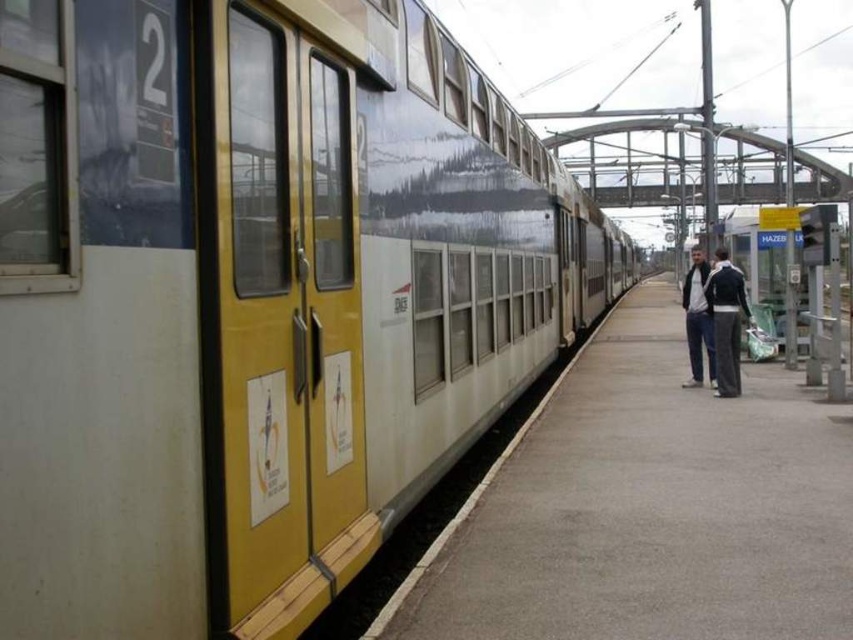
Is smooth concrete platform at center wider than dark blue jacket at center?

Yes.

Between point (753, 422) and point (735, 275), which one is positioned behind?

Positioned behind is point (735, 275).

The image size is (853, 640). What do you see at coordinates (647, 508) in the screenshot?
I see `smooth concrete platform at center` at bounding box center [647, 508].

You are a GUI agent. You are given a task and a screenshot of the screen. Output one action in this format:
    pyautogui.click(x=<x>, y=<y>)
    Task: Click on the smooth concrete platform at center
    
    Given the screenshot: What is the action you would take?
    647,508

Does dark blue jacket at center lie in front of dark blue jeans at right?

Yes.

Between dark blue jacket at center and dark blue jeans at right, which one has more height?

Standing taller between the two is dark blue jeans at right.

You are a GUI agent. You are given a task and a screenshot of the screen. Output one action in this format:
    pyautogui.click(x=<x>, y=<y>)
    Task: Click on the dark blue jacket at center
    This screenshot has width=853, height=640.
    Given the screenshot: What is the action you would take?
    pyautogui.click(x=726, y=321)

Does smooth concrete platform at center come behind dark blue jeans at right?

No, smooth concrete platform at center is closer to the viewer.

You are a GUI agent. You are given a task and a screenshot of the screen. Output one action in this format:
    pyautogui.click(x=<x>, y=<y>)
    Task: Click on the smooth concrete platform at center
    This screenshot has height=640, width=853.
    Given the screenshot: What is the action you would take?
    pyautogui.click(x=647, y=508)